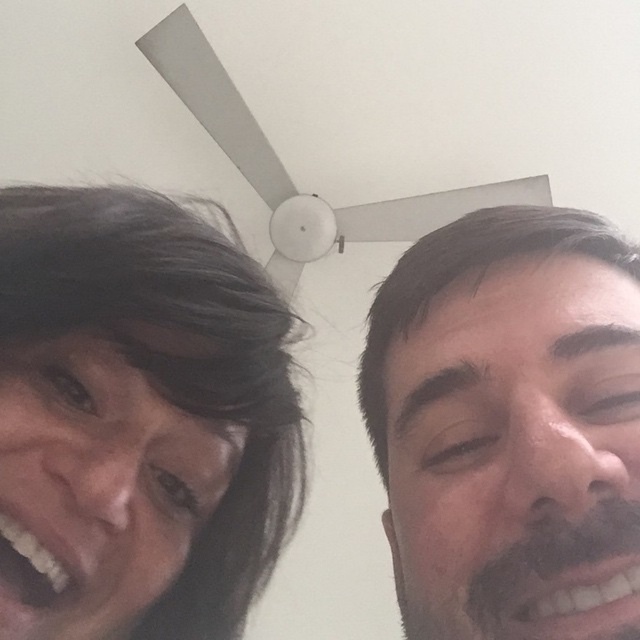
How much distance is there between matte black hair at upper center and smooth skin face at right?

The distance of matte black hair at upper center from smooth skin face at right is 4.48 centimeters.

Does matte black hair at upper center have a smaller size compared to smooth skin face at right?

No, matte black hair at upper center is not smaller than smooth skin face at right.

Between point (28, 422) and point (417, 406), which one is positioned behind?

Point (417, 406)

The image size is (640, 640). In order to click on matte black hair at upper center in this screenshot , I will do `click(138, 419)`.

Can you confirm if matte black hair at upper center is thinner than dark brown hair at left?

In fact, matte black hair at upper center might be wider than dark brown hair at left.

Which is more to the left, matte black hair at upper center or dark brown hair at left?

Positioned to the left is dark brown hair at left.

Which is in front, point (381, 413) or point (20, 476)?

Point (20, 476)

You are a GUI agent. You are given a task and a screenshot of the screen. Output one action in this format:
    pyautogui.click(x=<x>, y=<y>)
    Task: Click on the matte black hair at upper center
    This screenshot has height=640, width=640.
    Given the screenshot: What is the action you would take?
    pyautogui.click(x=138, y=419)

Does point (268, 397) come closer to viewer compared to point (515, 301)?

No, it is not.

Is dark brown hair at left positioned before smooth skin face at right?

No, dark brown hair at left is behind smooth skin face at right.

Is point (234, 445) less distant than point (480, 540)?

No, (234, 445) is further to viewer.

This screenshot has height=640, width=640. Find the location of `dark brown hair at left`. dark brown hair at left is located at coordinates (138, 419).